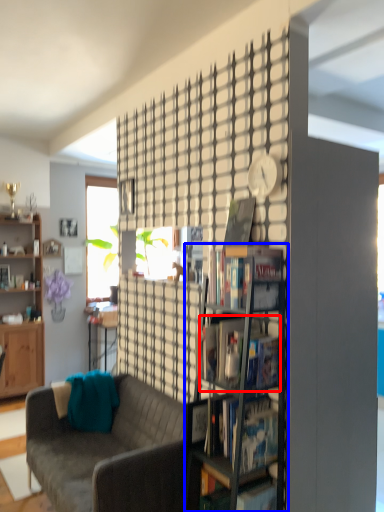
Question: Among these objects, which one is farthest to the camera, book (highlighted by a red box) or shelf (highlighted by a blue box)?

Choices:
 (A) book
 (B) shelf

Answer: (A)